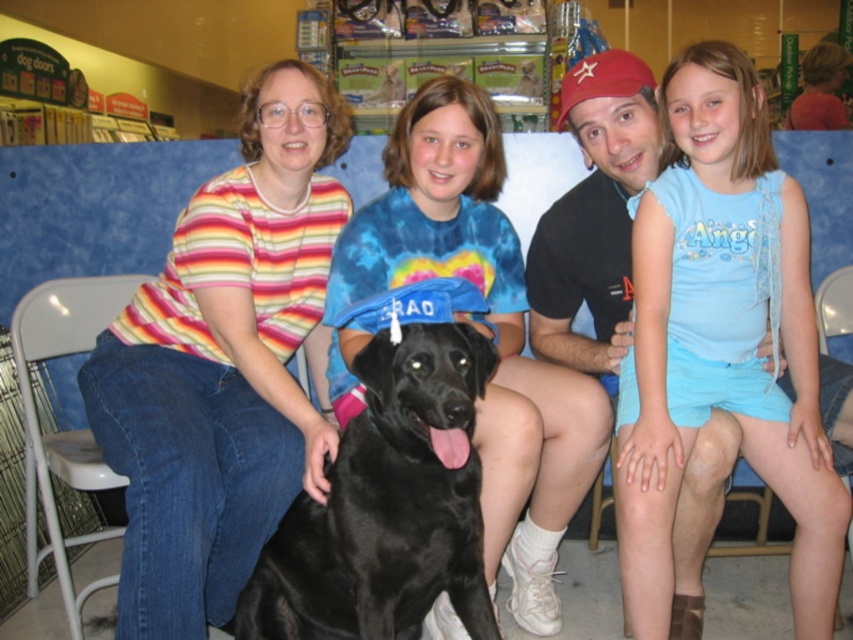
Question: Among these objects, which one is nearest to the camera?

Choices:
 (A) white plastic chair at lower left
 (B) tie-dye fabric shirt at center
 (C) striped cotton shirt at left

Answer: (C)

Question: Can you confirm if tie-dye fabric shirt at center is positioned above white plastic chair at lower left?

Choices:
 (A) yes
 (B) no

Answer: (A)

Question: Is tie-dye fabric shirt at center smaller than black matte dog at center?

Choices:
 (A) no
 (B) yes

Answer: (A)

Question: Can you confirm if tie-dye fabric shirt at center is positioned to the right of white plastic chair at lower left?

Choices:
 (A) yes
 (B) no

Answer: (A)

Question: Which point is closer to the camera taking this photo?

Choices:
 (A) (450, 188)
 (B) (299, 314)

Answer: (A)

Question: Which of the following is the closest to the observer?

Choices:
 (A) (299, 636)
 (B) (519, 284)

Answer: (A)